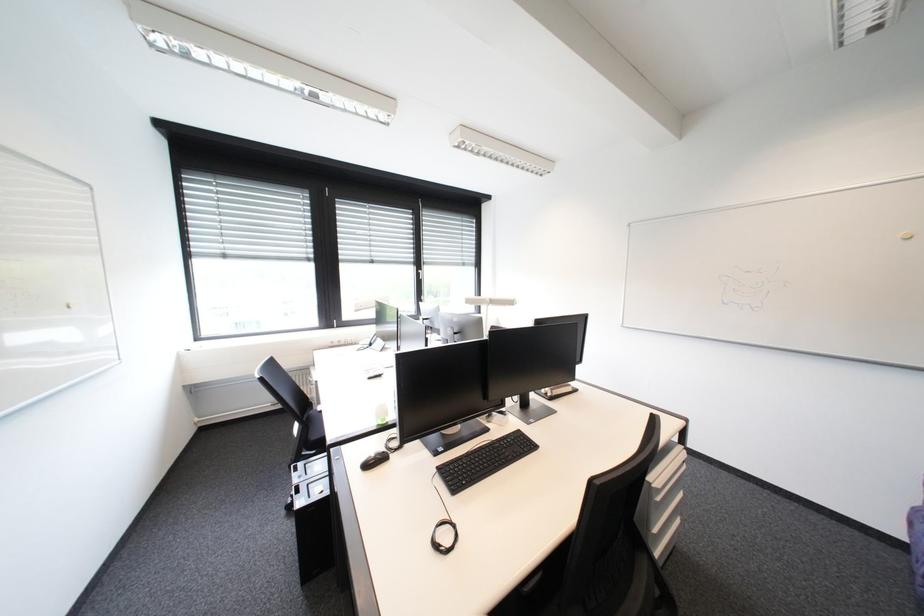
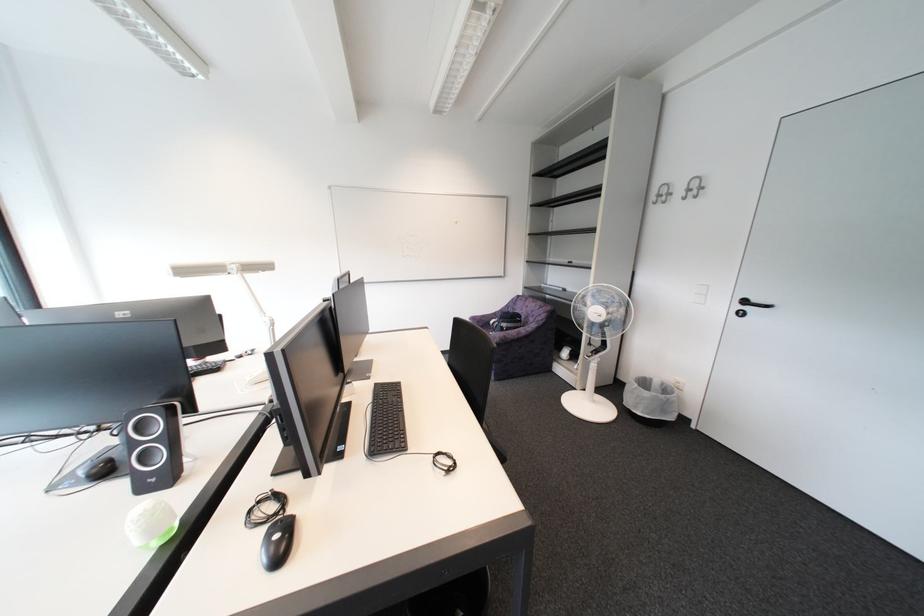
Question: The camera is either moving clockwise (left) or counter-clockwise (right) around the object. The first image is from the beginning of the video and the second image is from the end. Is the camera moving left or right when shooting the video?

Choices:
 (A) Left
 (B) Right

Answer: (A)